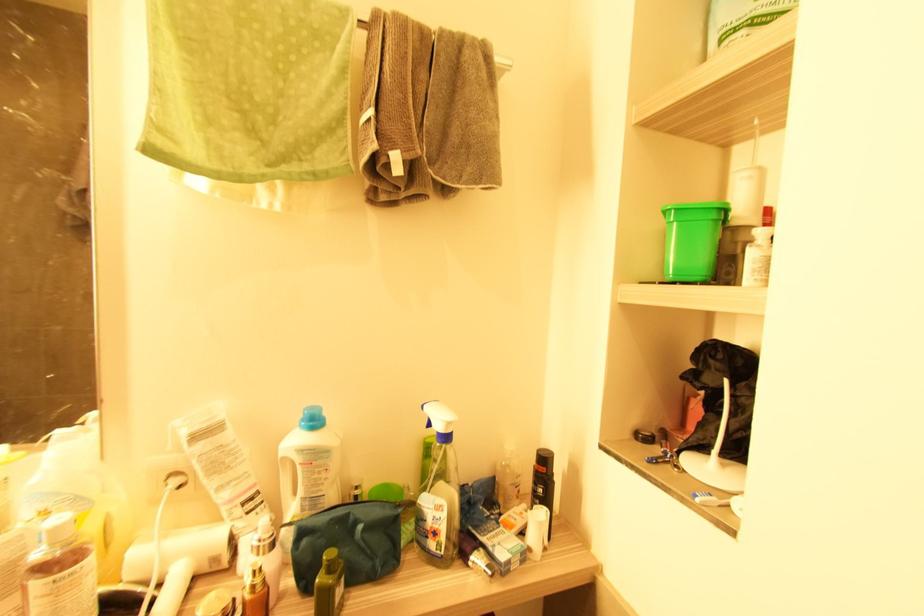
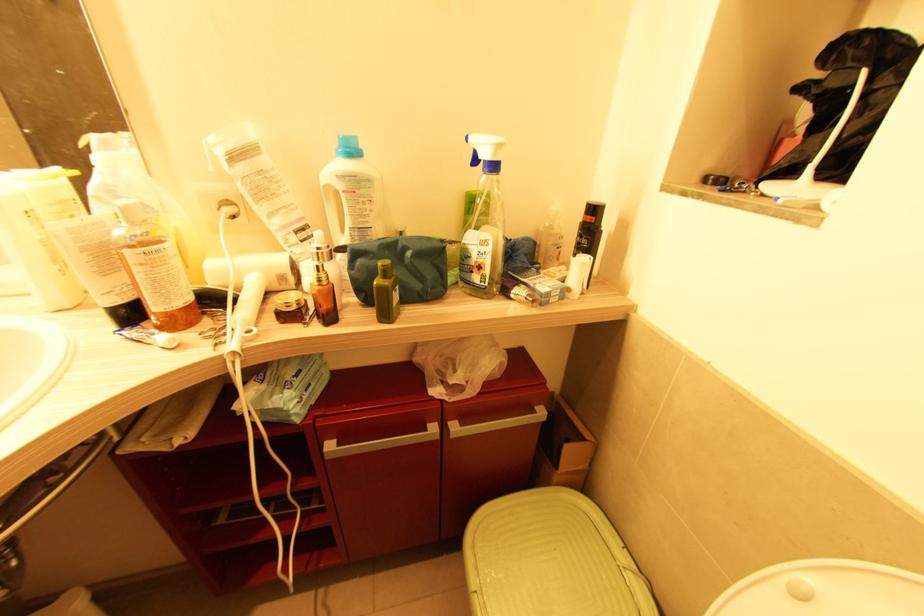
The point at (305, 419) is marked in the first image. Where is the corresponding point in the second image?

(341, 148)